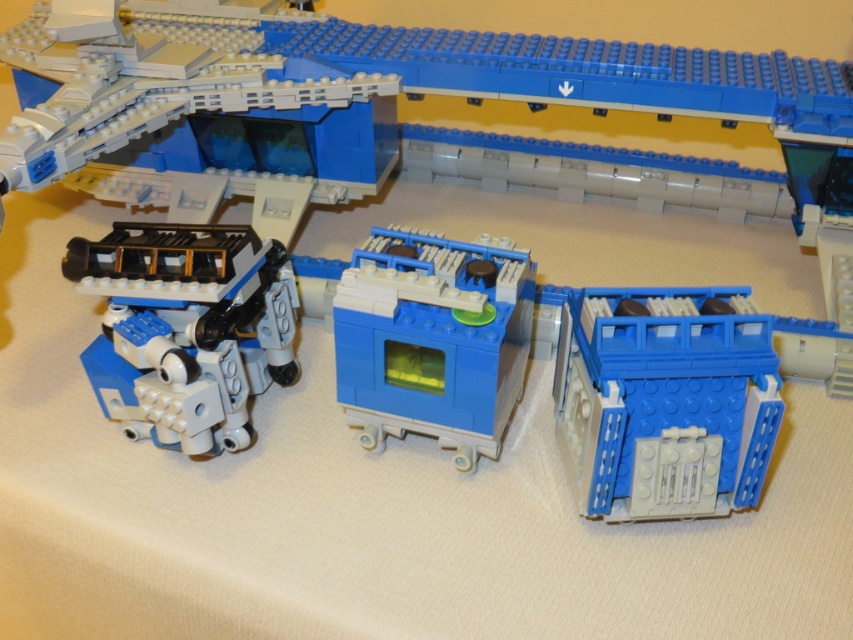
You are a delivery drone that needs to land between the blue plastic building at lower right and the matte black robot at lower left. The drone requires a minimum of 15 inches of space to land safely. Can you land there?

The blue plastic building at lower right and matte black robot at lower left are 17.66 inches apart from each other, which is more than the required 15 inches. Therefore, the delivery drone can safely land between them.

You are assembling a Lego set and need to place the blue plastic building at lower right next to the blue plastic machine at center. Based on their sizes, which one should you place first to ensure proper alignment?

The blue plastic building at lower right is smaller than the blue plastic machine at center. Therefore, you should place the blue plastic machine at center first as it is larger and serves as the base, allowing the smaller building to align correctly next to it.

You are trying to fit the matte black robot at lower left and the blue plastic machine at center into a storage box. The box can only accommodate one of them. Based on their widths, which one is more likely to fit?

The matte black robot at lower left might be wider than blue plastic machine at center, so the blue plastic machine at center is more likely to fit into the storage box.